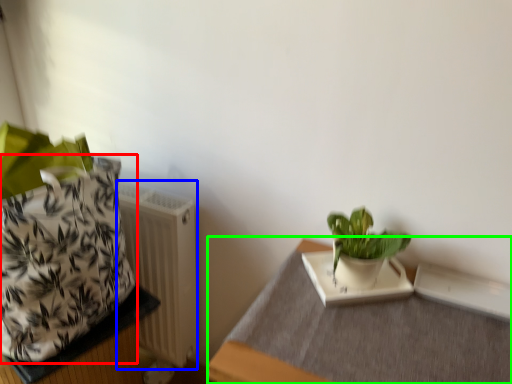
Question: Which object is the farthest from flowerpot (highlighted by a red box)? Choose among these: radiator (highlighted by a blue box) or table (highlighted by a green box).

Choices:
 (A) radiator
 (B) table

Answer: (B)